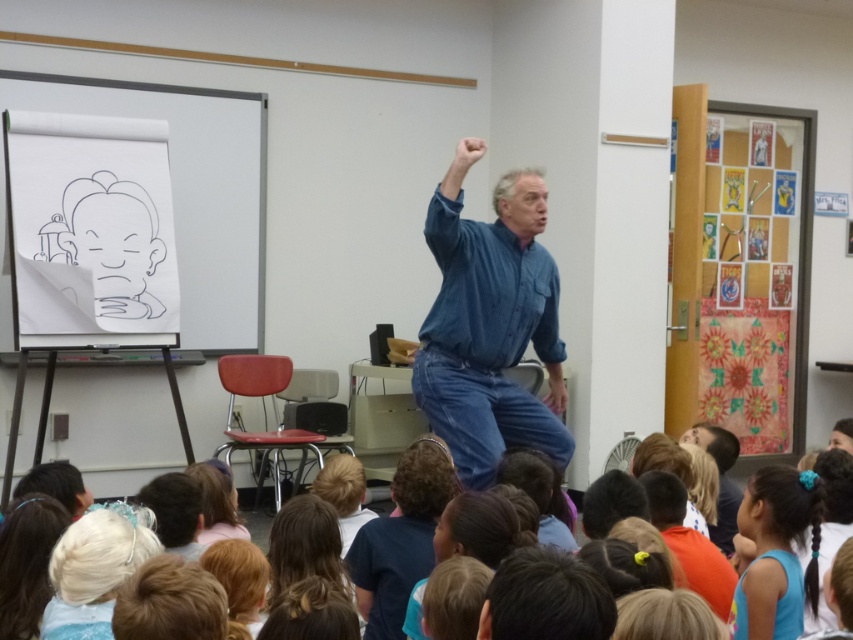
Question: Is denim shirt at center bigger than matte blue shirt at center?

Choices:
 (A) yes
 (B) no

Answer: (A)

Question: Is denim shirt at center positioned before matte blue shirt at center?

Choices:
 (A) no
 (B) yes

Answer: (B)

Question: Based on their relative distances, which object is nearer to the blue fabric hairband at lower right?

Choices:
 (A) denim shirt at center
 (B) matte blue shirt at center

Answer: (B)

Question: Is denim shirt at center positioned before blue fabric hairband at lower right?

Choices:
 (A) no
 (B) yes

Answer: (A)

Question: Which of the following is the closest to the observer?

Choices:
 (A) matte blue shirt at center
 (B) denim shirt at center
 (C) blue fabric hairband at lower right

Answer: (C)

Question: Among these points, which one is nearest to the camera?

Choices:
 (A) (498, 339)
 (B) (778, 541)
 (C) (727, 436)

Answer: (B)